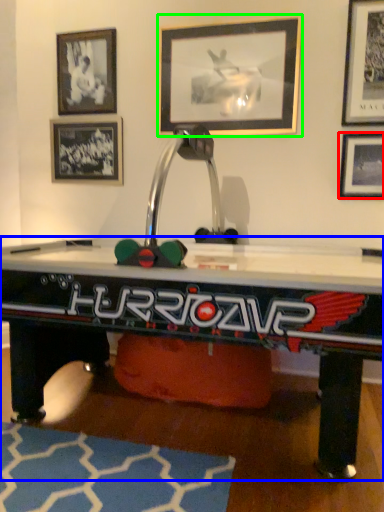
Question: Based on their relative distances, which object is nearer to picture frame (highlighted by a red box)? Choose from table (highlighted by a blue box) and picture frame (highlighted by a green box).

Choices:
 (A) table
 (B) picture frame

Answer: (B)